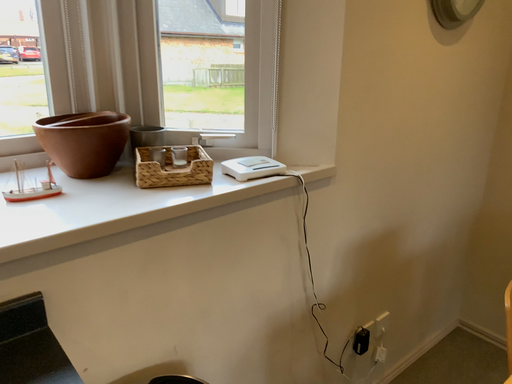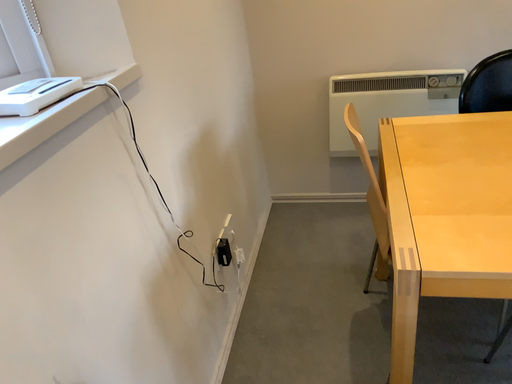
Question: How did the camera likely rotate when shooting the video?

Choices:
 (A) rotated left
 (B) rotated right

Answer: (B)